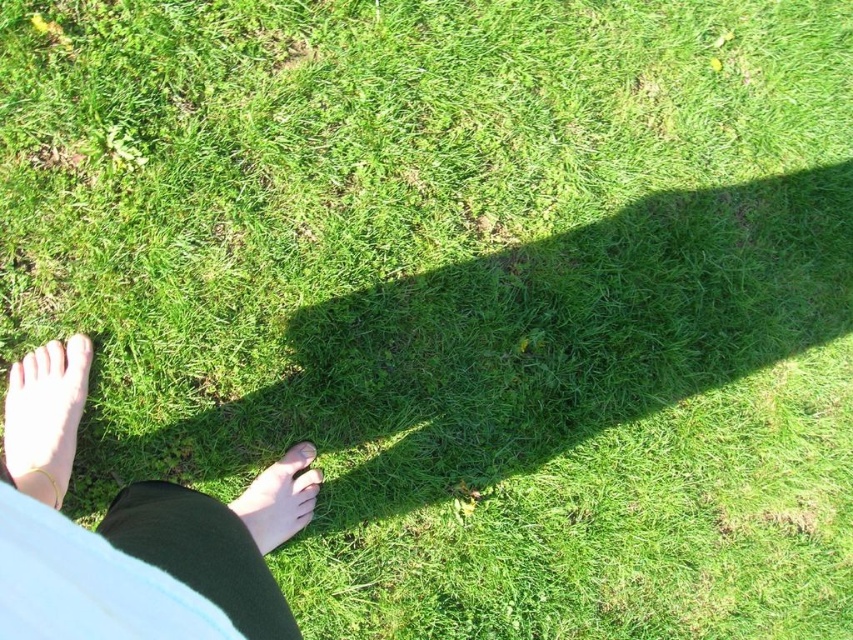
You are standing in a grassy area and want to place a small flag exactly at point [22,518]. If your eyes are 5 feet above the ground, can you see the flag from your current position?

The distance of point [22,518] from viewer is 32.71 inches, which is less than 5 feet. Therefore, the flag will be visible from your current position as it is within the line of sight.

You are a photographer trying to capture the gold metallic bracelet at lower left in focus while the skinny barefoot feet at lower left are slightly blurred. Can you achieve this with a shallow depth of field?

The skinny barefoot feet at lower left is closer to the viewer than the gold metallic bracelet at lower left. To have the bracelet in focus and the feet blurred, you need the bracelet to be farther away. Since the feet are closer, a shallow depth of field would keep the feet sharp and blur the background, which includes the bracelet. Therefore, it is possible to achieve the desired effect.